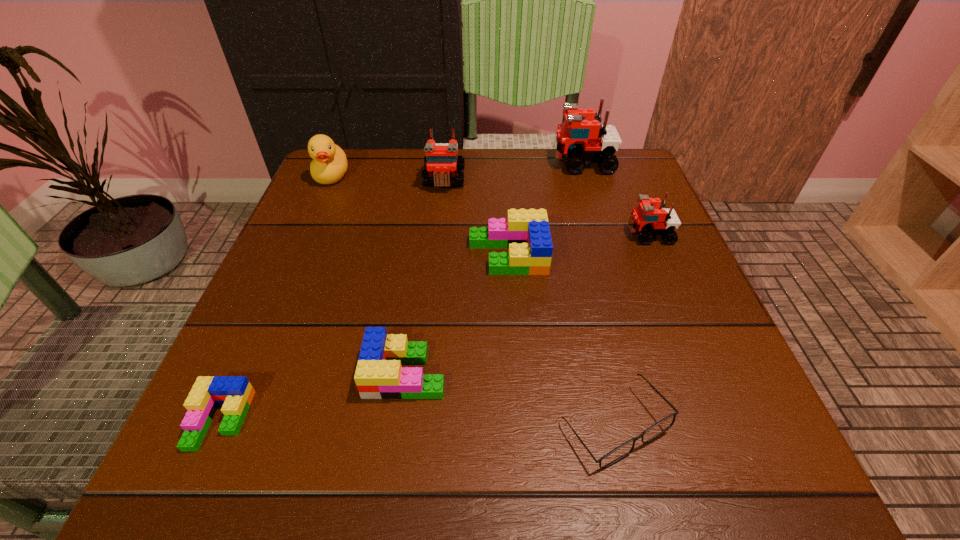
Identify the location of blank space located on the front-facing side of the fourth tallest object. The height and width of the screenshot is (540, 960). (516, 234).

Image resolution: width=960 pixels, height=540 pixels. I want to click on vacant area situated 0.330m on the front-facing side of the fourth tallest object, so click(468, 234).

Image resolution: width=960 pixels, height=540 pixels. In order to click on vacant area situated on the right of the biggest green Lego in this screenshot , I will do `click(582, 255)`.

This screenshot has width=960, height=540. I want to click on vacant position located 0.200m on the right of the fifth tallest Lego, so click(575, 373).

Image resolution: width=960 pixels, height=540 pixels. What are the coordinates of `vacant space located on the right of the leftmost Lego` in the screenshot? It's located at (394, 420).

Identify the location of duck positioned at the far edge. (329, 165).

Locate an element on the screen. This screenshot has width=960, height=540. spectacles located at the near edge is located at coordinates (620, 452).

Find the location of a particular element. The height and width of the screenshot is (540, 960). Lego at the near edge is located at coordinates (235, 393).

You are a GUI agent. You are given a task and a screenshot of the screen. Output one action in this format:
    pyautogui.click(x=<x>, y=<y>)
    Task: Click on the duck present at the left edge
    
    Given the screenshot: What is the action you would take?
    pyautogui.click(x=329, y=165)

Find the location of a particular element. Lego that is at the left edge is located at coordinates (235, 393).